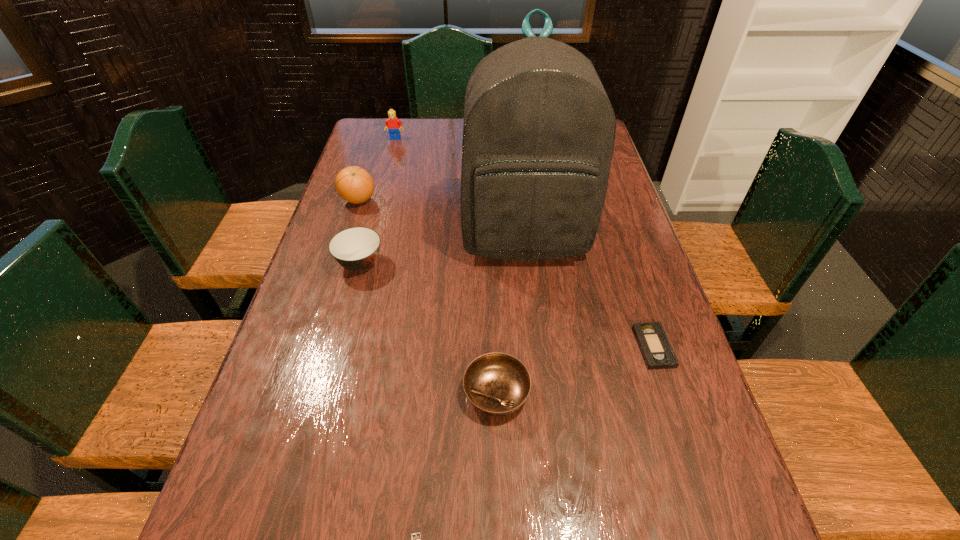
You are a GUI agent. You are given a task and a screenshot of the screen. Output one action in this format:
    pyautogui.click(x=<x>, y=<y>)
    Task: Click on the videotape situated at the right edge
    
    Given the screenshot: What is the action you would take?
    pyautogui.click(x=653, y=342)

Where is `object that is at the far left corner`? This screenshot has width=960, height=540. object that is at the far left corner is located at coordinates (393, 124).

In order to click on free space at the left edge in this screenshot , I will do `click(317, 316)`.

I want to click on vacant space at the right edge of the desktop, so click(x=620, y=232).

This screenshot has width=960, height=540. What are the coordinates of `vacant space at the far left corner of the desktop` in the screenshot? It's located at (369, 133).

You are a GUI agent. You are given a task and a screenshot of the screen. Output one action in this format:
    pyautogui.click(x=<x>, y=<y>)
    Task: Click on the free spot between the nearer soup bowl and the fourth tallest object
    Image resolution: width=960 pixels, height=540 pixels.
    Given the screenshot: What is the action you would take?
    pyautogui.click(x=428, y=328)

What are the coordinates of `vacant space that is in between the third shortest object and the second shortest object` in the screenshot? It's located at (575, 370).

The height and width of the screenshot is (540, 960). I want to click on free space that is in between the orange and the shorter soup bowl, so click(x=427, y=296).

The image size is (960, 540). I want to click on vacant space that's between the tallest object and the taller soup bowl, so click(x=442, y=251).

You are a GUI agent. You are given a task and a screenshot of the screen. Output one action in this format:
    pyautogui.click(x=<x>, y=<y>)
    Task: Click on the blank region between the videotape and the tallest object
    The image size is (960, 540).
    Given the screenshot: What is the action you would take?
    pyautogui.click(x=588, y=292)